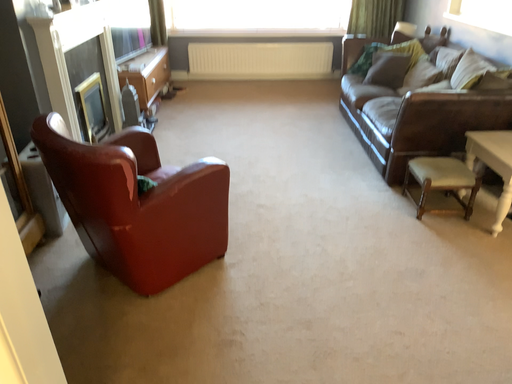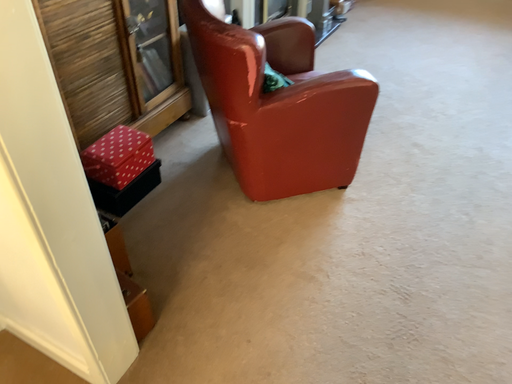
Question: How did the camera likely rotate when shooting the video?

Choices:
 (A) rotated downward
 (B) rotated upward

Answer: (A)